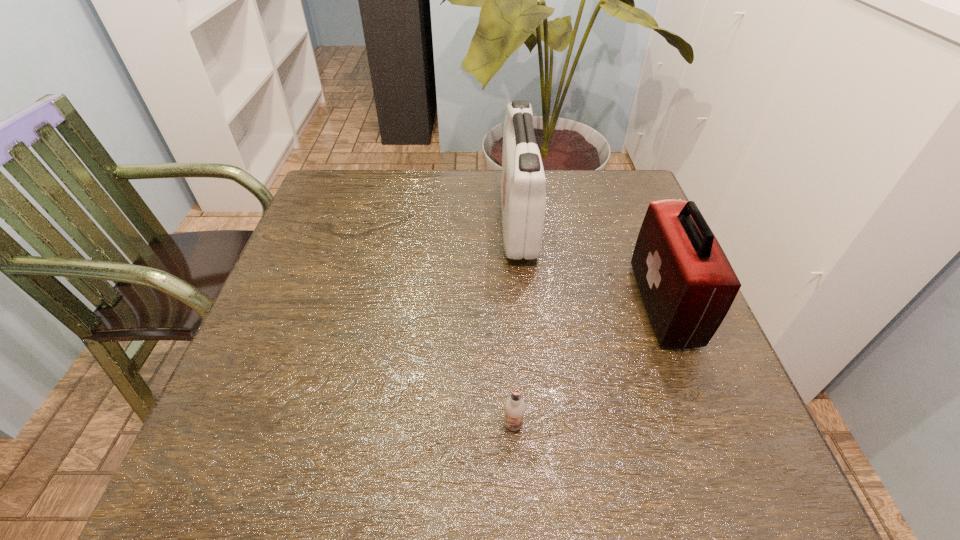
At what (x,y) coordinates should I click in order to perform the action: click on unoccupied position between the right first aid kit and the shortest object. Please return your answer as a coordinate pair (x, y). This screenshot has height=540, width=960. Looking at the image, I should click on (588, 364).

At what (x,y) coordinates should I click in order to perform the action: click on unoccupied area between the nearest object and the rightmost object. Please return your answer as a coordinate pair (x, y). This screenshot has width=960, height=540. Looking at the image, I should click on (588, 364).

Find the location of `vacant space that is in between the right first aid kit and the shortest object`. vacant space that is in between the right first aid kit and the shortest object is located at coordinates (588, 364).

At what (x,y) coordinates should I click in order to perform the action: click on free space between the left first aid kit and the right first aid kit. Please return your answer as a coordinate pair (x, y). The width and height of the screenshot is (960, 540). Looking at the image, I should click on (590, 263).

Identify the location of free space that is in between the rightmost object and the shortest object. This screenshot has height=540, width=960. (588, 364).

Locate an element on the screen. This screenshot has height=540, width=960. unoccupied position between the nearest object and the right first aid kit is located at coordinates click(588, 364).

Identify the location of free spot between the right first aid kit and the left first aid kit. This screenshot has width=960, height=540. (590, 263).

Identify the location of free space between the left first aid kit and the right first aid kit. (590, 263).

Where is `vacant space that's between the left first aid kit and the right first aid kit`? vacant space that's between the left first aid kit and the right first aid kit is located at coordinates click(590, 263).

Select which object is the closest to the nearest object. Please provide its 2D coordinates. Your answer should be formatted as a tuple, i.e. [(x, y)], where the tuple contains the x and y coordinates of a point satisfying the conditions above.

[(687, 284)]